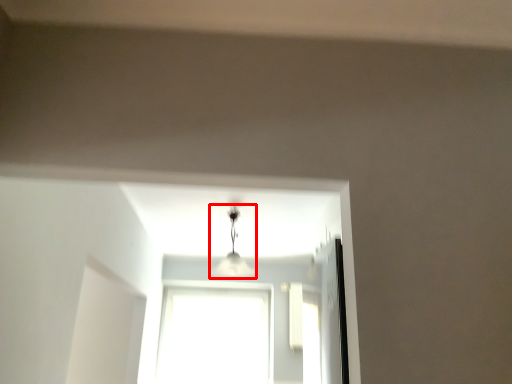
Question: From the image's perspective, what is the correct spatial relationship of lamp (annotated by the red box) in relation to window?

Choices:
 (A) above
 (B) below

Answer: (A)